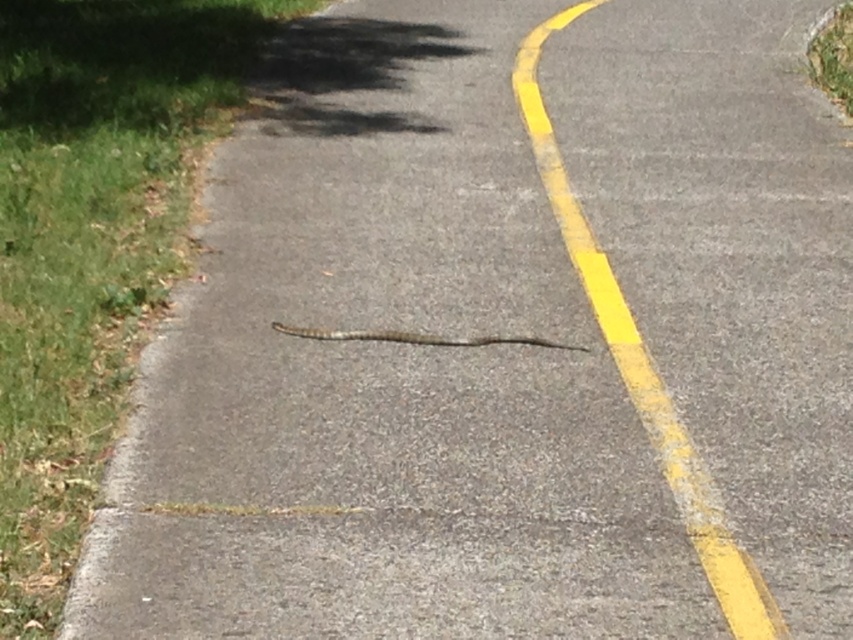
Question: Which point is closer to the camera?

Choices:
 (A) (396, 333)
 (B) (701, 513)

Answer: (B)

Question: Can you confirm if yellow asphalt curve at center is positioned to the left of brown scaly snake at center?

Choices:
 (A) no
 (B) yes

Answer: (A)

Question: Is yellow asphalt curve at center smaller than brown scaly snake at center?

Choices:
 (A) no
 (B) yes

Answer: (A)

Question: Does yellow asphalt curve at center have a larger size compared to brown scaly snake at center?

Choices:
 (A) yes
 (B) no

Answer: (A)

Question: Which point is closer to the camera?

Choices:
 (A) (561, 164)
 (B) (471, 342)

Answer: (B)

Question: Among these objects, which one is nearest to the camera?

Choices:
 (A) yellow asphalt curve at center
 (B) brown scaly snake at center

Answer: (A)